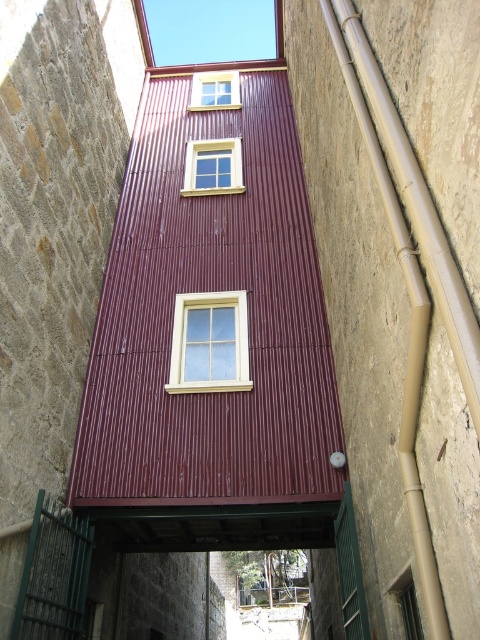
Does white wood window at center have a greater width compared to matte yellow window at upper center?

Yes, white wood window at center is wider than matte yellow window at upper center.

Between white wood window at center and matte yellow window at upper center, which one is positioned higher?

matte yellow window at upper center is higher up.

Identify the location of white wood window at center. This screenshot has width=480, height=640. (210, 342).

In the scene shown: Does white wood window at center come in front of wooden window at center?

Yes, white wood window at center is in front of wooden window at center.

The image size is (480, 640). What do you see at coordinates (210, 342) in the screenshot?
I see `white wood window at center` at bounding box center [210, 342].

Locate an element on the screen. This screenshot has height=640, width=480. white wood window at center is located at coordinates (210, 342).

Is wooden window at center positioned at the back of matte yellow window at upper center?

No, wooden window at center is closer to the viewer.

Measure the distance between wooden window at center and matte yellow window at upper center.

wooden window at center is 2.10 meters from matte yellow window at upper center.

The height and width of the screenshot is (640, 480). I want to click on wooden window at center, so click(213, 168).

What are the coordinates of `wooden window at center` in the screenshot? It's located at (213, 168).